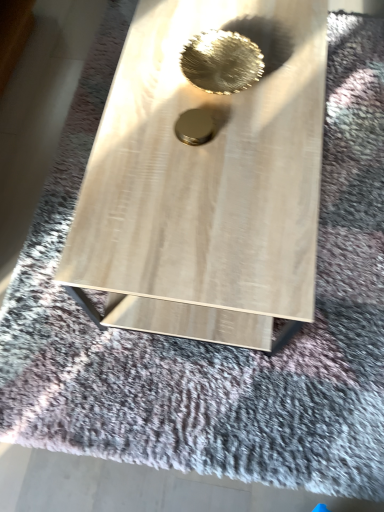
The width and height of the screenshot is (384, 512). What are the coordinates of `vacant space that is in between metallic gold bowl at center, acting as the 2th hole starting from the bottom, and gold metallic circle at center, arranged as the first hole when ordered from the bottom` in the screenshot? It's located at (221, 115).